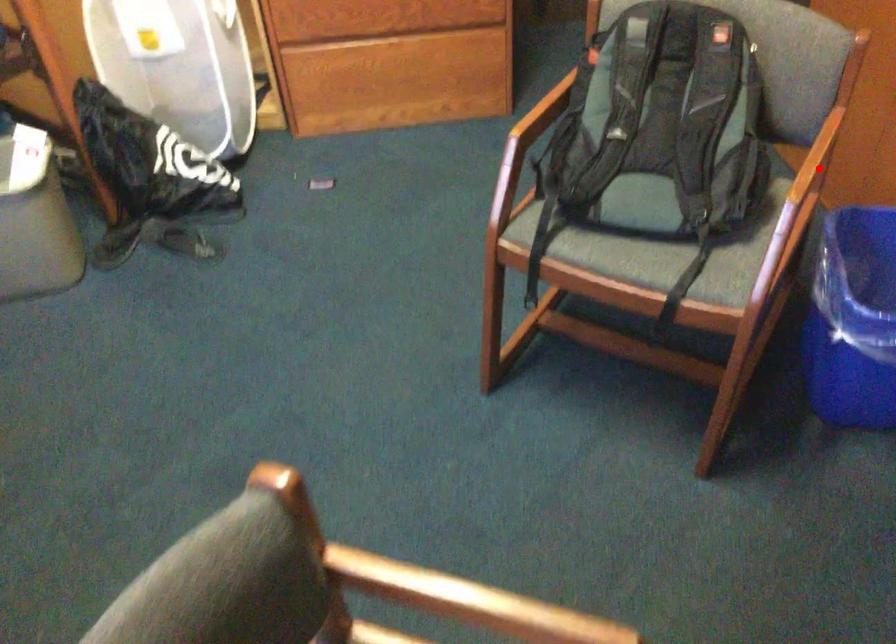
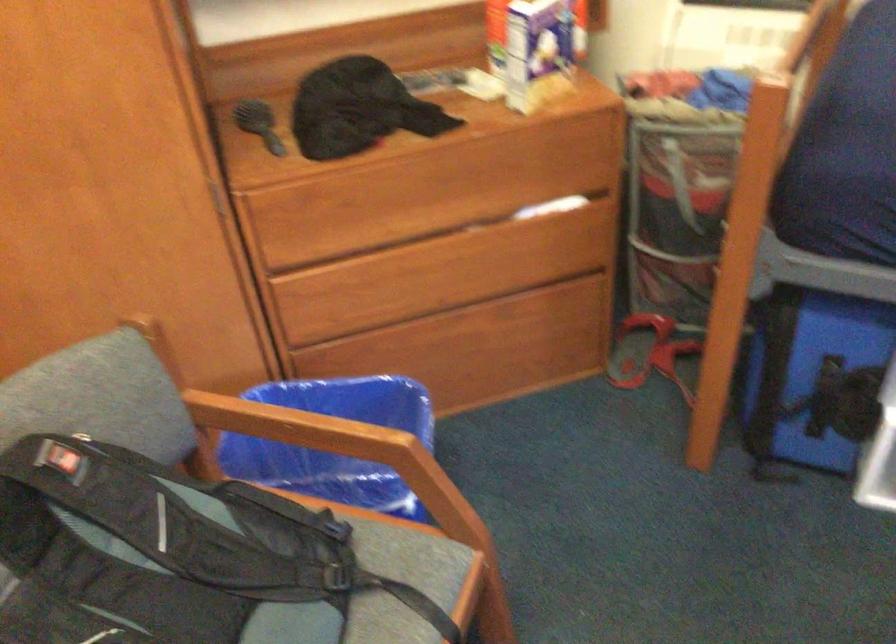
Find the pixel in the second image that matches the highlighted location in the first image.

(290, 424)